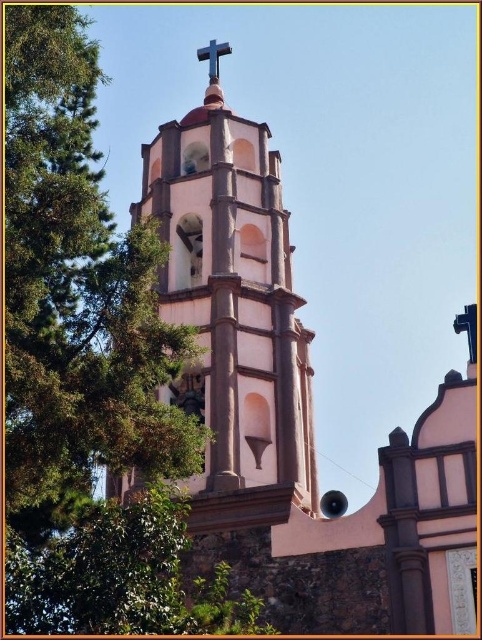
Question: Is pink stucco tower at center smaller than metallic cross at upper center?

Choices:
 (A) no
 (B) yes

Answer: (A)

Question: Is pink stucco church tower at center to the left of metallic cross at upper center from the viewer's perspective?

Choices:
 (A) yes
 (B) no

Answer: (B)

Question: Which of the following is the farthest from the observer?

Choices:
 (A) metallic cross at upper center
 (B) pink stucco tower at center

Answer: (A)

Question: Considering the real-world distances, which object is closest to the pink stucco tower at center?

Choices:
 (A) pink stucco church tower at center
 (B) metallic cross at upper center

Answer: (A)

Question: Is pink stucco church tower at center below pink stucco tower at center?

Choices:
 (A) no
 (B) yes

Answer: (B)

Question: Which of the following is the closest to the observer?

Choices:
 (A) pink stucco church tower at center
 (B) pink stucco tower at center
 (C) metallic cross at upper center

Answer: (A)